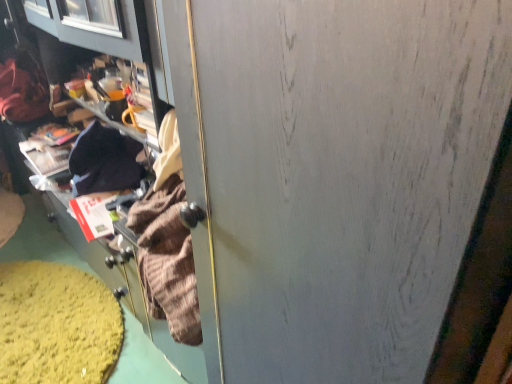
Where is `velvet-like brown sweater at left`? The image size is (512, 384). velvet-like brown sweater at left is located at coordinates (22, 92).

What do you see at coordinates (22, 92) in the screenshot?
I see `velvet-like brown sweater at left` at bounding box center [22, 92].

Where is `cardboard box at lower left`? The width and height of the screenshot is (512, 384). cardboard box at lower left is located at coordinates (56, 325).

This screenshot has width=512, height=384. Describe the element at coordinates (56, 325) in the screenshot. I see `cardboard box at lower left` at that location.

Measure the distance between cardboard box at lower left and camera.

cardboard box at lower left is 4.52 feet from camera.

What are the coordinates of `velvet-like brown sweater at left` in the screenshot? It's located at coord(22,92).

Considering the relative positions of velvet-like brown sweater at left and cardboard box at lower left in the image provided, is velvet-like brown sweater at left to the left of cardboard box at lower left from the viewer's perspective?

Correct, you'll find velvet-like brown sweater at left to the left of cardboard box at lower left.

Which is behind, velvet-like brown sweater at left or cardboard box at lower left?

velvet-like brown sweater at left is behind.

Between point (44, 84) and point (85, 380), which one is positioned in front?

The point (85, 380) is closer to the camera.

From the image's perspective, is velvet-like brown sweater at left positioned above or below cardboard box at lower left?

Based on their image positions, velvet-like brown sweater at left is located above cardboard box at lower left.

From a real-world perspective, who is located lower, velvet-like brown sweater at left or cardboard box at lower left?

In real-world perspective, cardboard box at lower left is lower.

Can you confirm if velvet-like brown sweater at left is thinner than cardboard box at lower left?

Yes, velvet-like brown sweater at left is thinner than cardboard box at lower left.

Is velvet-like brown sweater at left shorter than cardboard box at lower left?

No, velvet-like brown sweater at left is not shorter than cardboard box at lower left.

Based on the photo, looking at the image, does velvet-like brown sweater at left seem bigger or smaller compared to cardboard box at lower left?

velvet-like brown sweater at left is bigger than cardboard box at lower left.

Would you say velvet-like brown sweater at left is outside cardboard box at lower left?

That's correct, velvet-like brown sweater at left is outside of cardboard box at lower left.

Is velvet-like brown sweater at left not near cardboard box at lower left?

No, velvet-like brown sweater at left is not far from cardboard box at lower left.

Is velvet-like brown sweater at left looking in the opposite direction of cardboard box at lower left?

No, velvet-like brown sweater at left's orientation is not away from cardboard box at lower left.

Can you tell me how much velvet-like brown sweater at left and cardboard box at lower left differ in facing direction?

The angle between the facing direction of velvet-like brown sweater at left and the facing direction of cardboard box at lower left is 93.6 degrees.

In the image, there is a cardboard box at lower left. In order to click on clothing above it (from the image's perspective) in this screenshot , I will do `click(22, 92)`.

Would you say cardboard box at lower left is to the left or to the right of velvet-like brown sweater at left in the picture?

Based on their positions, cardboard box at lower left is located to the right of velvet-like brown sweater at left.

Who is more distant, cardboard box at lower left or velvet-like brown sweater at left?

velvet-like brown sweater at left is further from the camera.

Is point (90, 362) closer to viewer compared to point (35, 94)?

Yes, point (90, 362) is closer to viewer.

From the image's perspective, is cardboard box at lower left on top of velvet-like brown sweater at left?

Incorrect, from the image's perspective, cardboard box at lower left is lower than velvet-like brown sweater at left.

From a real-world perspective, relative to velvet-like brown sweater at left, is cardboard box at lower left vertically above or below?

cardboard box at lower left is situated lower than velvet-like brown sweater at left in the real world.

Which object is wider, cardboard box at lower left or velvet-like brown sweater at left?

cardboard box at lower left.

Who is taller, cardboard box at lower left or velvet-like brown sweater at left?

velvet-like brown sweater at left is taller.

Considering the sizes of objects cardboard box at lower left and velvet-like brown sweater at left in the image provided, who is bigger, cardboard box at lower left or velvet-like brown sweater at left?

velvet-like brown sweater at left is bigger.

Can we say cardboard box at lower left lies outside velvet-like brown sweater at left?

Yes, cardboard box at lower left is outside of velvet-like brown sweater at left.

Is cardboard box at lower left not near velvet-like brown sweater at left?

No, there isn't a large distance between cardboard box at lower left and velvet-like brown sweater at left.

Could you tell me if cardboard box at lower left is facing velvet-like brown sweater at left?

No, cardboard box at lower left is not facing towards velvet-like brown sweater at left.

Locate an element on the screen. The width and height of the screenshot is (512, 384). debris below the velvet-like brown sweater at left (from the image's perspective) is located at coordinates (56, 325).

In the image, there is a cardboard box at lower left. At what (x,y) coordinates should I click in order to perform the action: click on clothing above it (from the image's perspective). Please return your answer as a coordinate pair (x, y). Looking at the image, I should click on (22, 92).

You are a GUI agent. You are given a task and a screenshot of the screen. Output one action in this format:
    pyautogui.click(x=<x>, y=<y>)
    Task: Click on the debris that appears below the velvet-like brown sweater at left (from the image's perspective)
    The width and height of the screenshot is (512, 384).
    Given the screenshot: What is the action you would take?
    [x=56, y=325]